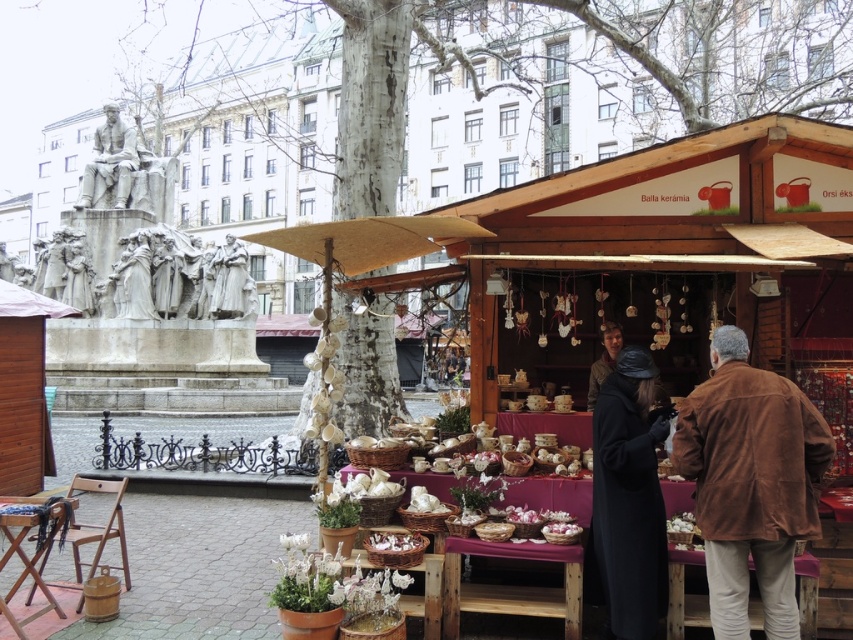
Is brown suede jacket at lower right to the right of dark brown leather jacket at lower right from the viewer's perspective?

Yes, brown suede jacket at lower right is to the right of dark brown leather jacket at lower right.

Can you confirm if brown suede jacket at lower right is positioned above dark brown leather jacket at lower right?

No.

Image resolution: width=853 pixels, height=640 pixels. Describe the element at coordinates (750, 483) in the screenshot. I see `brown suede jacket at lower right` at that location.

You are a GUI agent. You are given a task and a screenshot of the screen. Output one action in this format:
    pyautogui.click(x=<x>, y=<y>)
    Task: Click on the brown suede jacket at lower right
    This screenshot has height=640, width=853.
    Given the screenshot: What is the action you would take?
    pyautogui.click(x=750, y=483)

Does brown suede jacket at lower right appear on the right side of black wool coat at center?

Correct, you'll find brown suede jacket at lower right to the right of black wool coat at center.

Does brown suede jacket at lower right appear on the left side of black wool coat at center?

In fact, brown suede jacket at lower right is to the right of black wool coat at center.

Locate an element on the screen. brown suede jacket at lower right is located at coordinates (750, 483).

Describe the element at coordinates (628, 499) in the screenshot. I see `black wool coat at center` at that location.

The height and width of the screenshot is (640, 853). I want to click on black wool coat at center, so click(x=628, y=499).